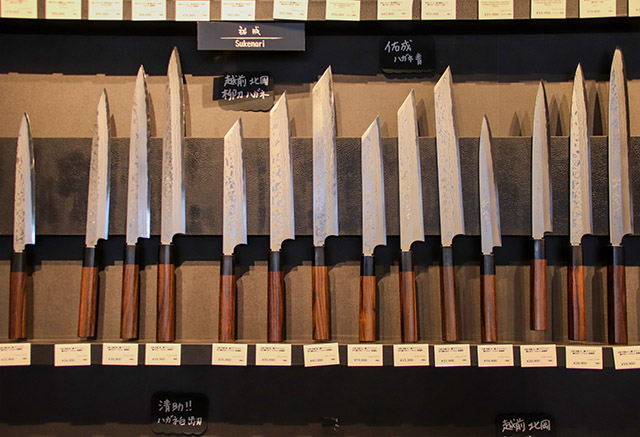
Identify the location of hole in wall. (326, 422).